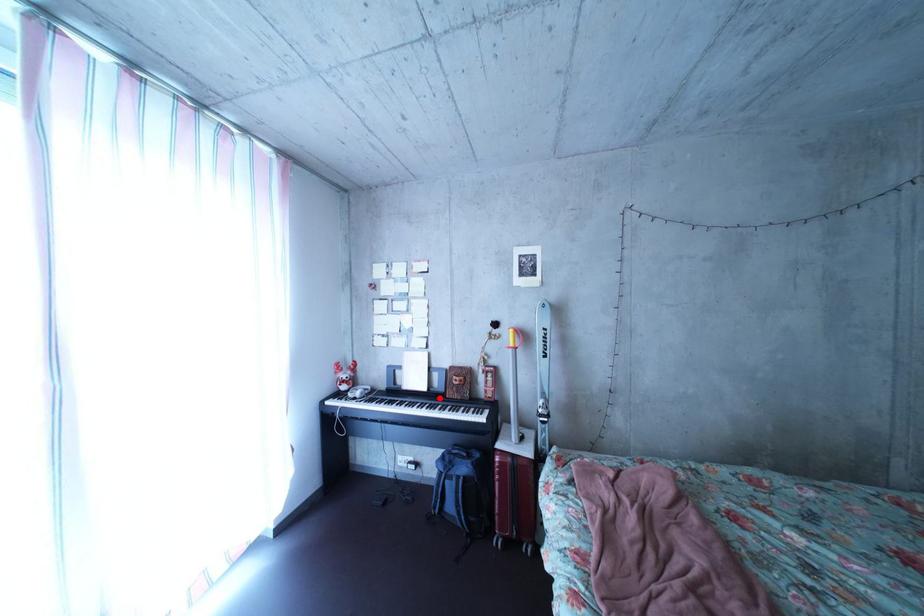
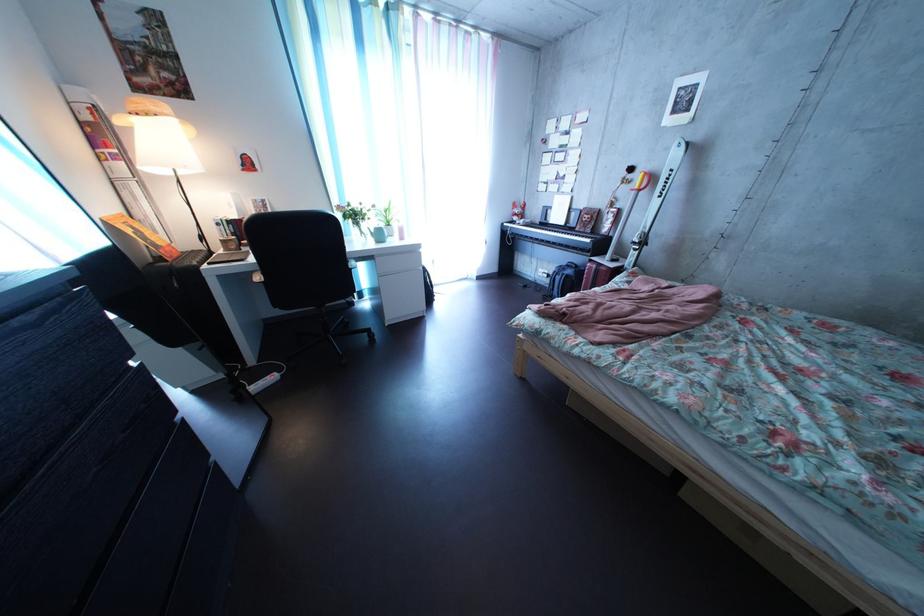
Question: I am providing you with two images of the same scene from different viewpoints. In image1, a red point is highlighted. Considering the same 3D point in image2, which of the following is correct?

Choices:
 (A) It is closer
 (B) It is farther

Answer: (A)